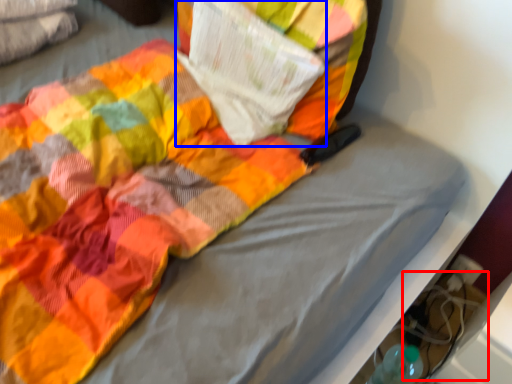
Question: Which point is further to the camera, footwear (highlighted by a red box) or paperback book (highlighted by a blue box)?

Choices:
 (A) footwear
 (B) paperback book

Answer: (A)